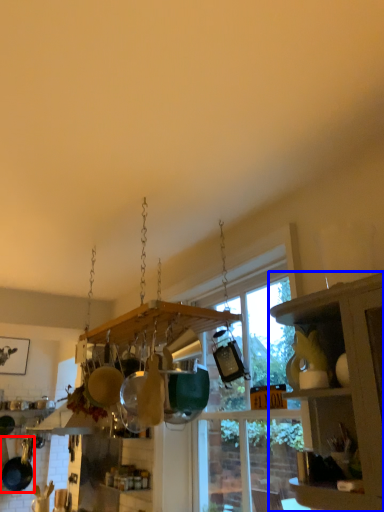
Question: Which object is further to the camera taking this photo, frying pan (highlighted by a red box) or cabinetry (highlighted by a blue box)?

Choices:
 (A) frying pan
 (B) cabinetry

Answer: (A)